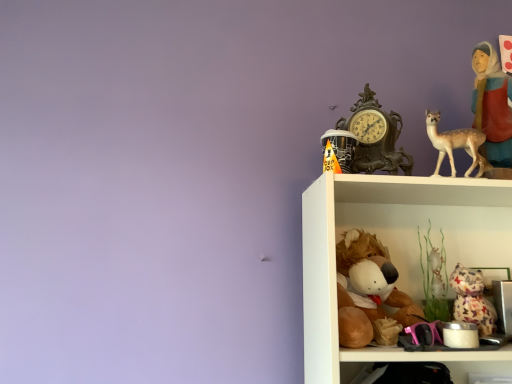
Question: Considering the positions of matte red fabric at upper right and antique bronze clock at upper right in the image, is matte red fabric at upper right wider or thinner than antique bronze clock at upper right?

Choices:
 (A) wide
 (B) thin

Answer: (A)

Question: Is matte red fabric at upper right bigger or smaller than antique bronze clock at upper right?

Choices:
 (A) small
 (B) big

Answer: (B)

Question: Based on their relative distances, which object is farther from the matte red fabric at upper right?

Choices:
 (A) orange paper cone at upper right, arranged as the 1th toy when viewed from the left
 (B) antique bronze clock at upper right
 (C) light beige porcelain deer at upper right
 (D) patterned fabric cat at lower right, the third toy positioned from the left
 (E) brown plush toy at lower center, the 2th toy from the right

Answer: (E)

Question: Considering the real-world distances, which object is farthest from the brown plush toy at lower center, the 2th toy positioned from the left?

Choices:
 (A) antique bronze clock at upper right
 (B) patterned fabric cat at lower right, the third toy positioned from the left
 (C) light beige porcelain deer at upper right
 (D) orange paper cone at upper right, arranged as the 1th toy when viewed from the left
 (E) matte red fabric at upper right

Answer: (E)